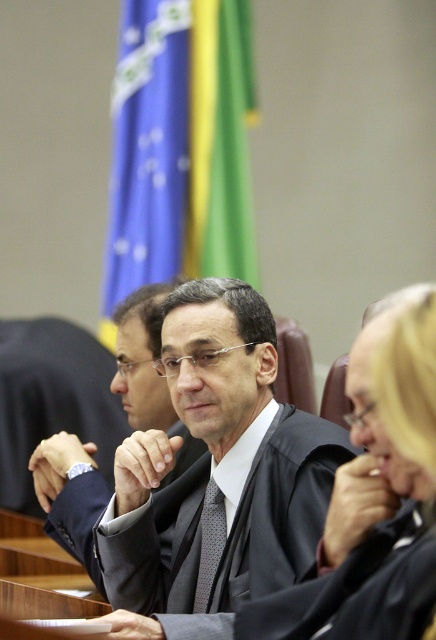
Does black matte suit at center have a lesser height compared to black textured tie at center?

In fact, black matte suit at center may be taller than black textured tie at center.

Which is in front, point (40, 465) or point (207, 586)?

Point (207, 586)

Image resolution: width=436 pixels, height=640 pixels. Identify the location of black matte suit at center. (147, 371).

Locate an element on the screen. This screenshot has height=640, width=436. black matte suit at center is located at coordinates (147, 371).

Image resolution: width=436 pixels, height=640 pixels. What do you see at coordinates (374, 499) in the screenshot? I see `smooth black robe at center` at bounding box center [374, 499].

Who is more distant from viewer, [363,621] or [207,509]?

Point [207,509]

Where is `smooth black robe at center`? The image size is (436, 640). smooth black robe at center is located at coordinates (374, 499).

What are the coordinates of `smooth black robe at center` in the screenshot? It's located at (374, 499).

Can you confirm if black matte judge at center is positioned above black textured tie at center?

Correct, black matte judge at center is located above black textured tie at center.

Is point (194, 552) farther from camera compared to point (211, 582)?

That is True.

Is point (111, 620) closer to camera compared to point (218, 548)?

Yes, point (111, 620) is closer to viewer.

At what (x,y) coordinates should I click in order to perform the action: click on black matte judge at center. Please return your answer as a coordinate pair (x, y). Looking at the image, I should click on (204, 476).